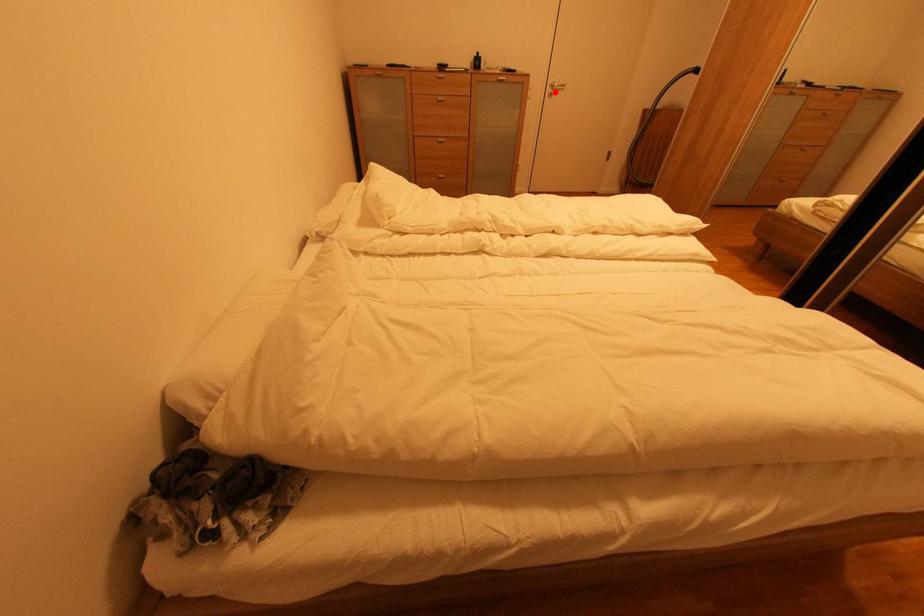
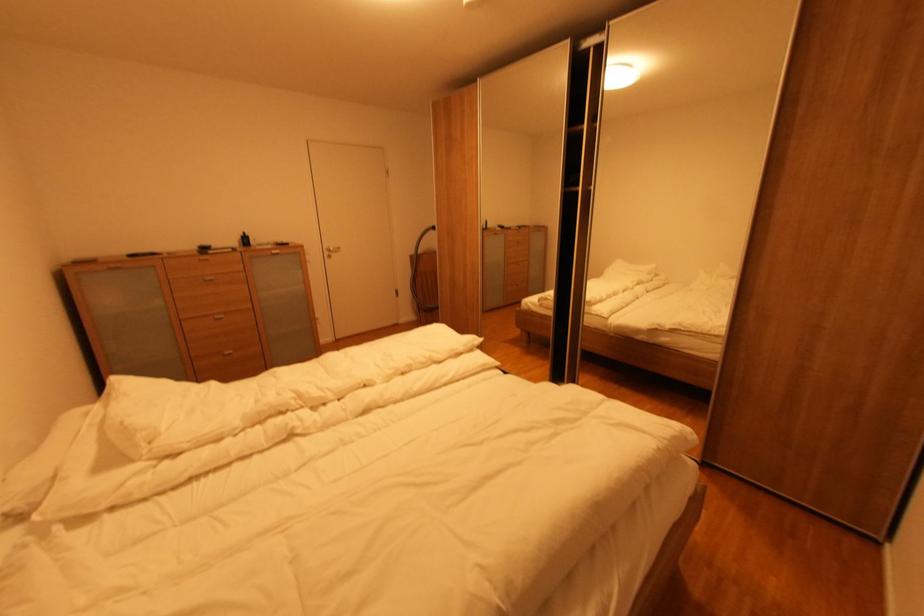
Where in the second image is the point corresponding to the highlighted location from the first image?

(333, 254)